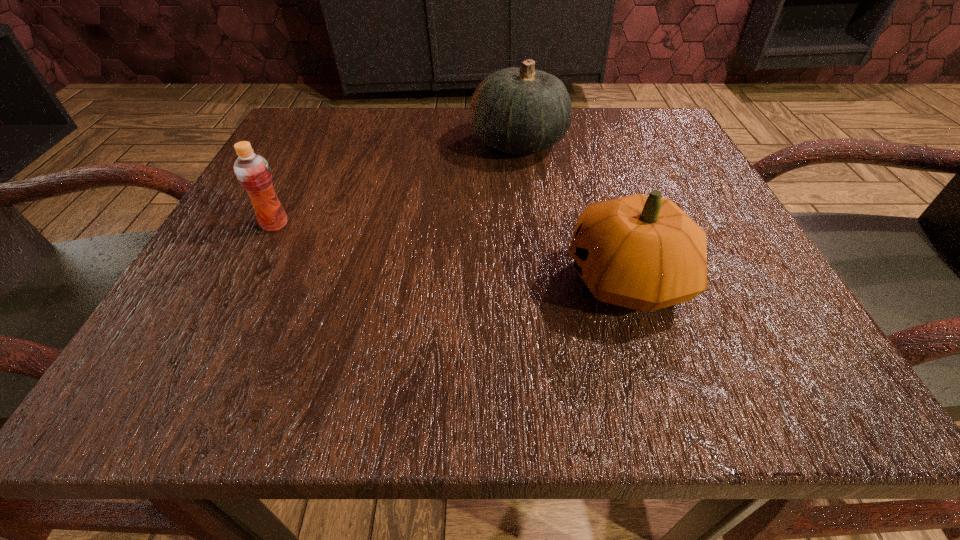
Point out which object is positioned as the nearest to the second nearest object. Please provide its 2D coordinates. Your answer should be formatted as a tuple, i.e. [(x, y)], where the tuple contains the x and y coordinates of a point satisfying the conditions above.

[(522, 110)]

You are a GUI agent. You are given a task and a screenshot of the screen. Output one action in this format:
    pyautogui.click(x=<x>, y=<y>)
    Task: Click on the free location that satisfies the following two spatial constraints: 1. on the back side of the farthest object; 2. on the right side of the second farthest object
    
    Given the screenshot: What is the action you would take?
    pyautogui.click(x=317, y=143)